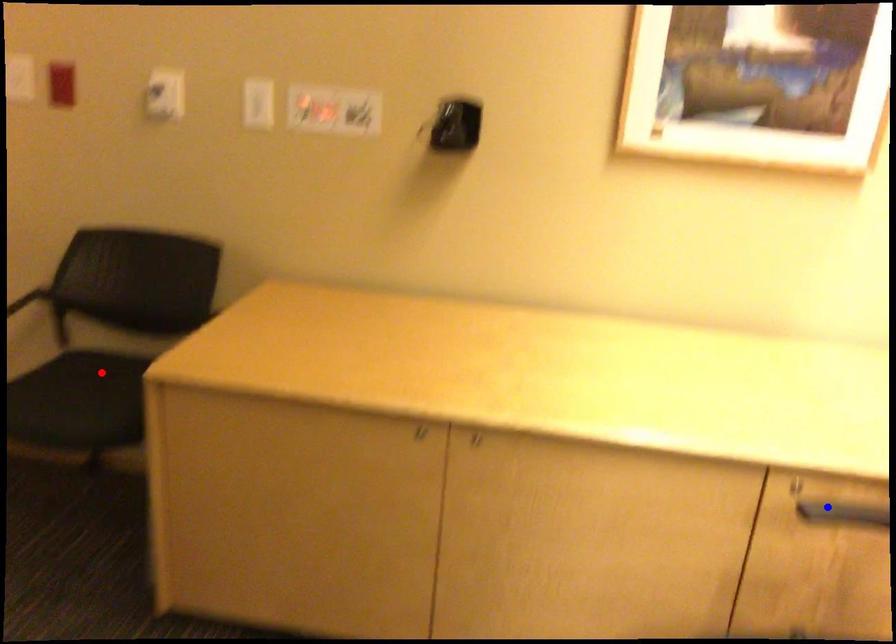
Question: Which of the two points in the image is closer to the camera?

Choices:
 (A) Blue point is closer.
 (B) Red point is closer.

Answer: (A)